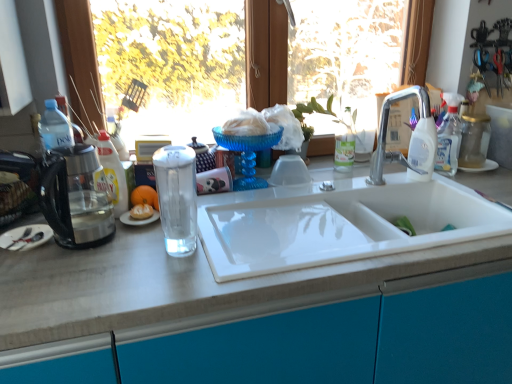
Find the location of `vacant point to the right of white fluffy food at center`. vacant point to the right of white fluffy food at center is located at coordinates (209, 218).